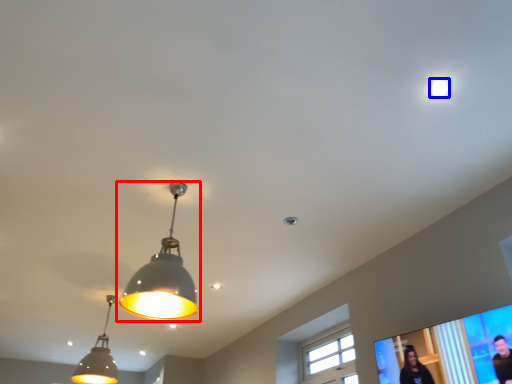
Question: Which point is closer to the camera, lamp (highlighted by a red box) or droplight (highlighted by a blue box)?

Choices:
 (A) lamp
 (B) droplight

Answer: (B)